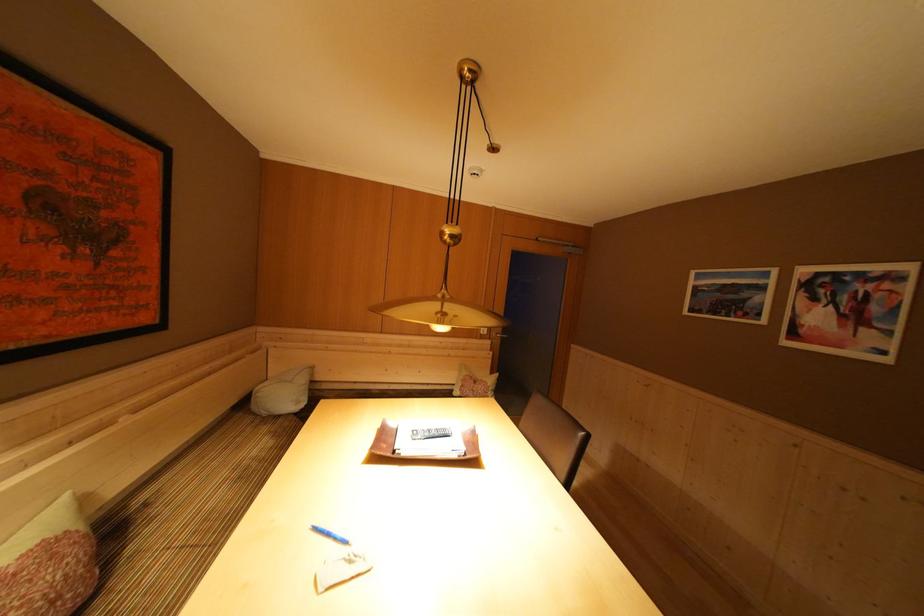
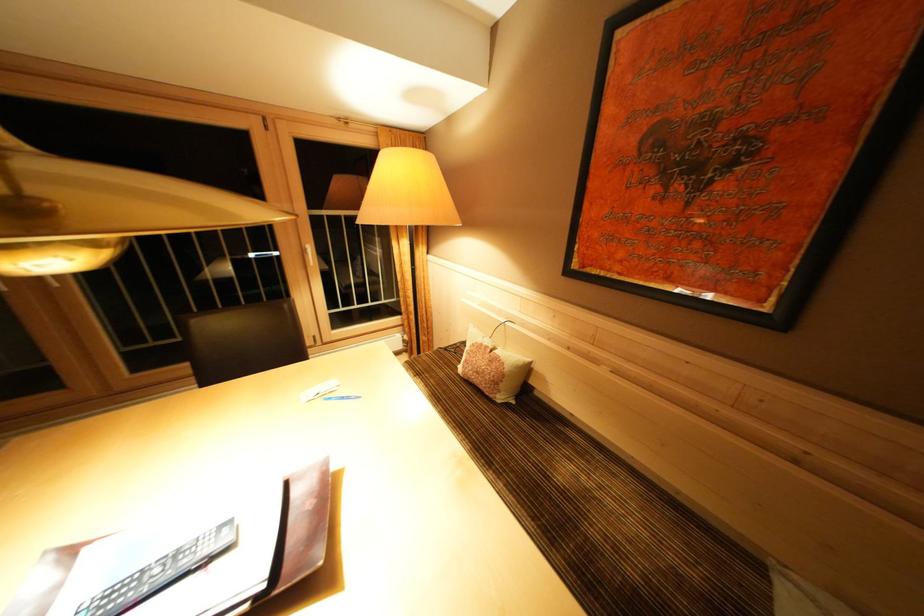
Find the pixel in the second image that matches point 153,509 in the first image.

(565, 438)